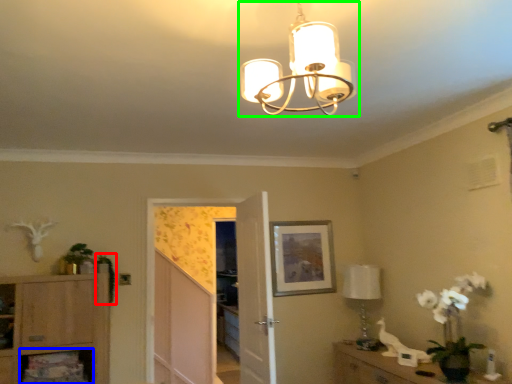
Question: Which object is the closest to the plant (highlighted by a red box)? Choose among these: shelf (highlighted by a blue box) or lamp (highlighted by a green box).

Choices:
 (A) shelf
 (B) lamp

Answer: (A)